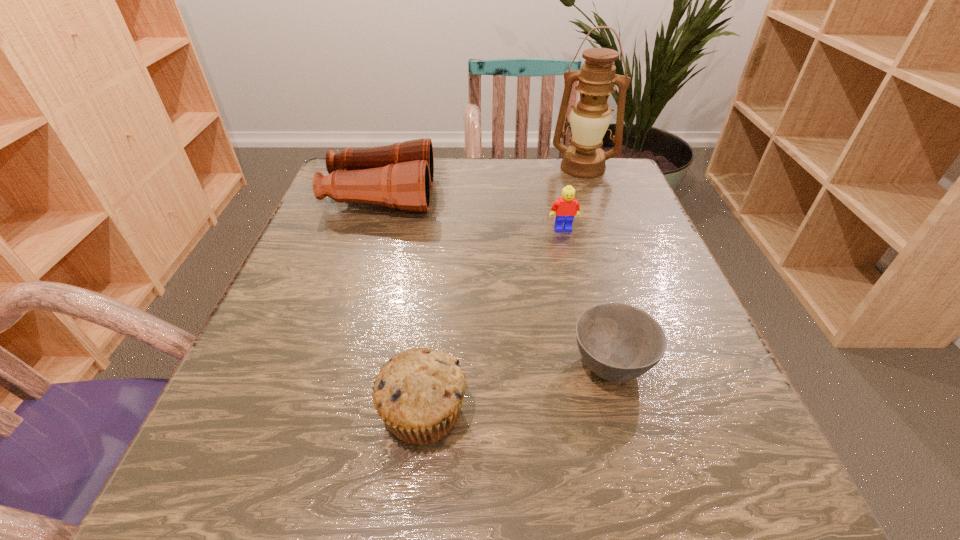
This screenshot has height=540, width=960. In the image, there is a desktop. Find the location of `vacant space at the left edge`. vacant space at the left edge is located at coordinates (313, 336).

Image resolution: width=960 pixels, height=540 pixels. Identify the location of vacant space at the right edge of the desktop. (660, 293).

This screenshot has height=540, width=960. Find the location of `vacant space at the near right corner of the desktop`. vacant space at the near right corner of the desktop is located at coordinates (780, 487).

Identify the location of empty location between the muffin and the tallest object. (503, 289).

Locate an element on the screen. free space between the third farthest object and the shortest object is located at coordinates (587, 297).

At what (x,y) coordinates should I click in order to perform the action: click on free space between the third farthest object and the muffin. Please return your answer as a coordinate pair (x, y). Looking at the image, I should click on (493, 321).

Where is `free space between the third nearest object and the muffin`? This screenshot has width=960, height=540. free space between the third nearest object and the muffin is located at coordinates (493, 321).

At what (x,y) coordinates should I click in order to perform the action: click on unoccupied position between the oil lamp and the muffin. Please return your answer as a coordinate pair (x, y). This screenshot has width=960, height=540. Looking at the image, I should click on pos(503,289).

Where is `free space between the bowl and the oil lamp`? This screenshot has width=960, height=540. free space between the bowl and the oil lamp is located at coordinates (x=597, y=266).

The width and height of the screenshot is (960, 540). I want to click on empty location between the bowl and the muffin, so click(516, 388).